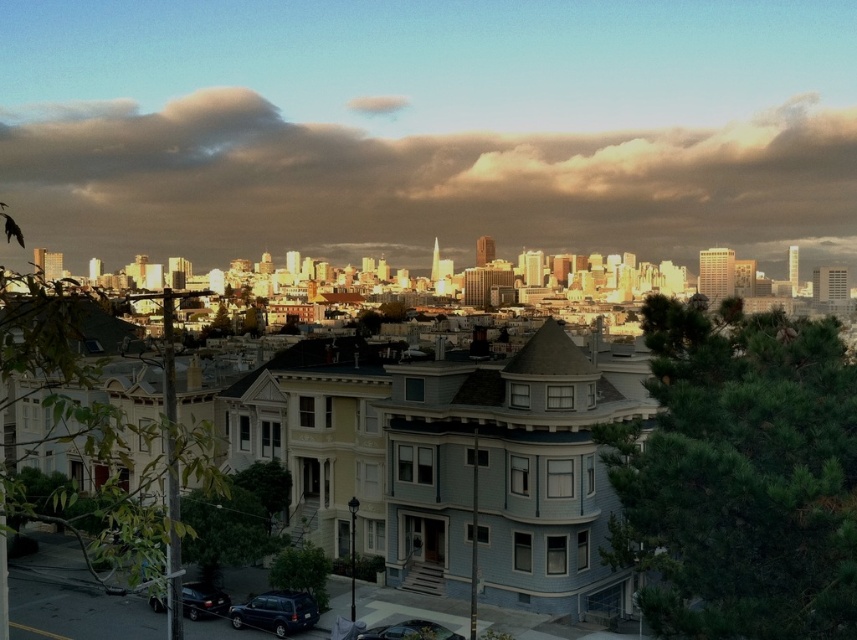
Question: Considering the relative positions of matte black suv at lower left and shiny black sedan at lower left in the image provided, where is matte black suv at lower left located with respect to shiny black sedan at lower left?

Choices:
 (A) below
 (B) above

Answer: (A)

Question: Where is matte black suv at lower left located in relation to metallic silver car at lower center in the image?

Choices:
 (A) below
 (B) above

Answer: (B)

Question: Which of the following is the farthest from the observer?

Choices:
 (A) (705, 189)
 (B) (430, 637)

Answer: (A)

Question: Which object is positioned farthest from the cloudy sky at upper center?

Choices:
 (A) shiny black sedan at lower left
 (B) metallic silver car at lower center

Answer: (A)

Question: Can you confirm if shiny black sedan at lower left is smaller than metallic silver car at lower center?

Choices:
 (A) no
 (B) yes

Answer: (A)

Question: Which point is farther from the camera taking this photo?

Choices:
 (A) [298, 611]
 (B) [259, 216]
 (C) [391, 636]
 (D) [190, 600]

Answer: (B)